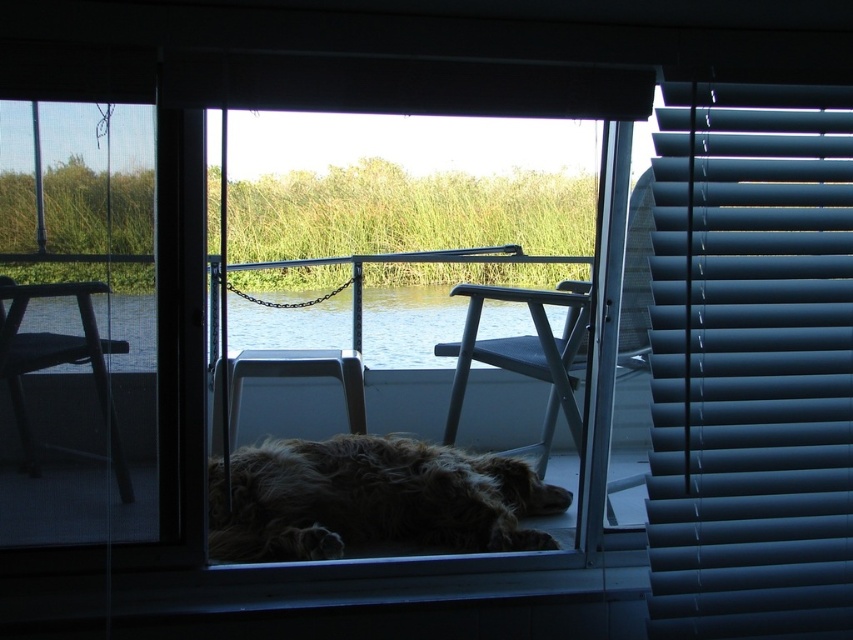
Who is positioned more to the left, matte blue blinds at right or clear water at center?

clear water at center is more to the left.

Is matte blue blinds at right smaller than clear water at center?

Yes, matte blue blinds at right is smaller than clear water at center.

Is point (775, 188) positioned behind point (523, 324)?

No, (775, 188) is closer to viewer.

What are the coordinates of `matte blue blinds at right` in the screenshot? It's located at (751, 364).

Based on the photo, can you confirm if clear water at center is positioned above metallic gray chair at center?

Yes, clear water at center is above metallic gray chair at center.

Is point (259, 337) closer to camera compared to point (579, 442)?

No, (259, 337) is behind (579, 442).

Where is `clear water at center`? clear water at center is located at coordinates (409, 324).

Does clear water at center lie behind matte plastic chair at center?

Yes, it is.

Between clear water at center and matte plastic chair at center, which one appears on the right side from the viewer's perspective?

clear water at center

Between point (302, 292) and point (236, 358), which one is positioned behind?

The point (302, 292) is behind.

You are a GUI agent. You are given a task and a screenshot of the screen. Output one action in this format:
    pyautogui.click(x=<x>, y=<y>)
    Task: Click on the clear water at center
    Image resolution: width=853 pixels, height=640 pixels.
    Given the screenshot: What is the action you would take?
    pyautogui.click(x=409, y=324)